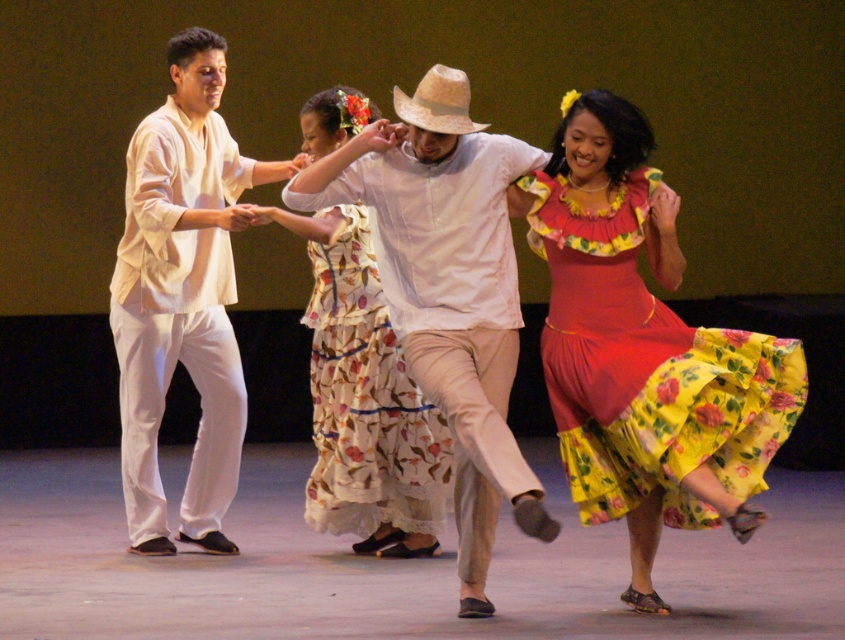
Measure the distance from floral cotton dress at right to floral cotton dress at center.

floral cotton dress at right and floral cotton dress at center are 4.92 feet apart.

The image size is (845, 640). Describe the element at coordinates (647, 369) in the screenshot. I see `floral cotton dress at right` at that location.

You are a GUI agent. You are given a task and a screenshot of the screen. Output one action in this format:
    pyautogui.click(x=<x>, y=<y>)
    Task: Click on the floral cotton dress at right
    The image size is (845, 640).
    Given the screenshot: What is the action you would take?
    pyautogui.click(x=647, y=369)

Does point (664, 371) come closer to viewer compared to point (178, 314)?

Yes.

Is point (669, 403) farther from viewer compared to point (180, 349)?

No.

This screenshot has width=845, height=640. Describe the element at coordinates (647, 369) in the screenshot. I see `floral cotton dress at right` at that location.

The height and width of the screenshot is (640, 845). In order to click on floral cotton dress at right in this screenshot , I will do `click(647, 369)`.

How much distance is there between white cotton shirt at center and matte white shirt at center?

They are 5.08 feet apart.

Does white cotton shirt at center appear on the right side of matte white shirt at center?

Correct, you'll find white cotton shirt at center to the right of matte white shirt at center.

Who is more forward, (433, 244) or (194, 481)?

Positioned in front is point (433, 244).

Locate an element on the screen. The width and height of the screenshot is (845, 640). white cotton shirt at center is located at coordinates (448, 304).